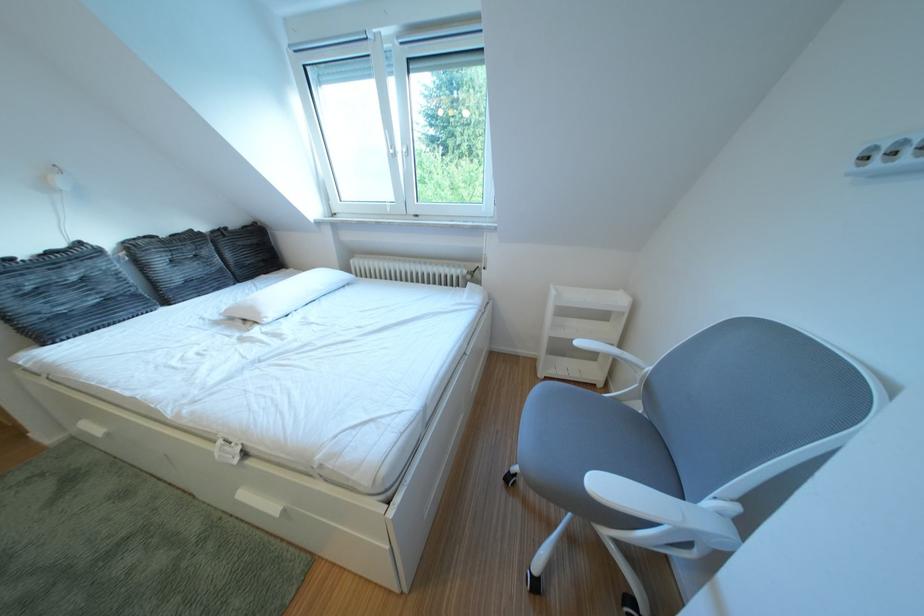
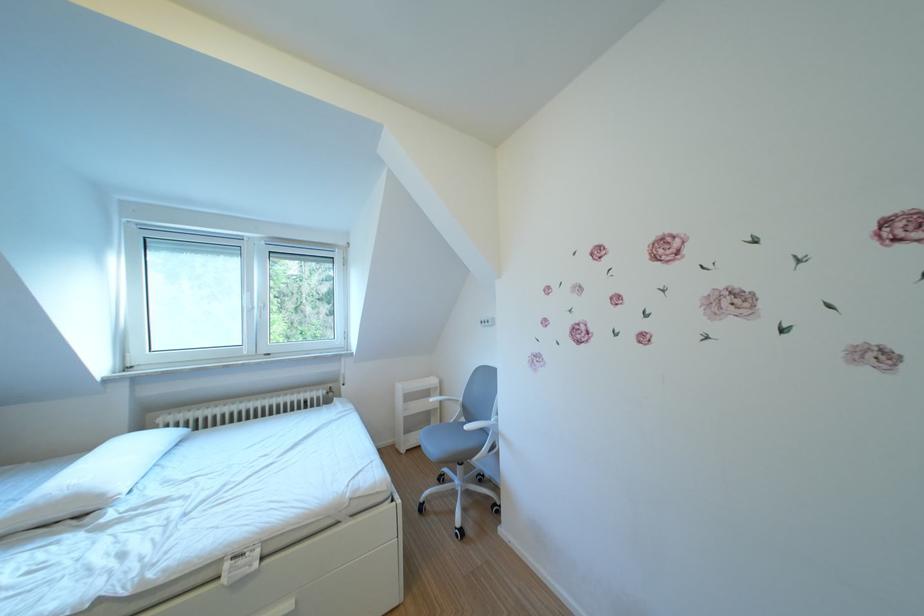
The point at (407, 151) is marked in the first image. Where is the corresponding point in the second image?

(265, 307)